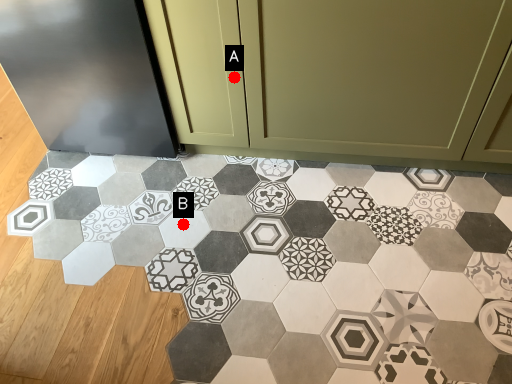
Question: Two points are circled on the image, labeled by A and B beside each circle. Which of the following is the closest to the observer?

Choices:
 (A) A is closer
 (B) B is closer

Answer: (A)